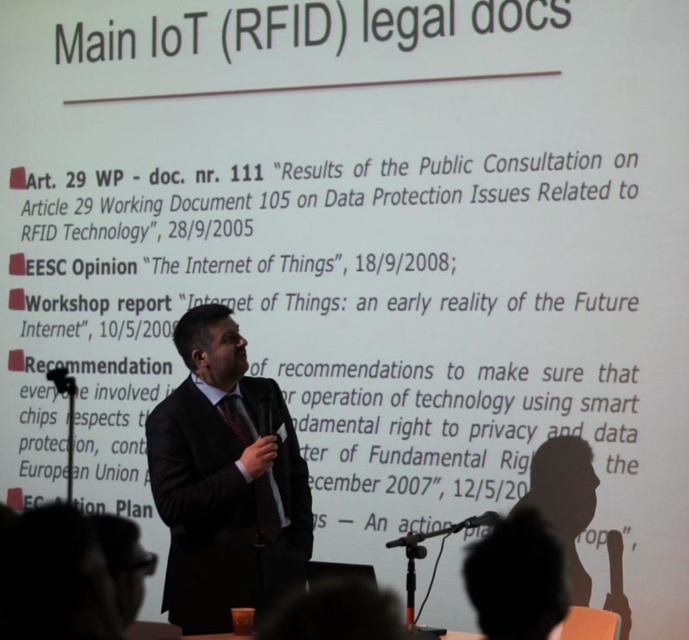
You are an event organizer and need to place a podium for the speaker wearing the black suit at center. According to the 2D coordinates provided, what are the exact coordinates where the podium should be placed to ensure it is directly behind the speaker?

The podium should be placed at the same coordinates as the black suit at center, which is point [225,481], to ensure it is directly behind the speaker.

You are a photographer standing at the camera position. You need to capture a clear photo of the black suit at center. The minimum focusing distance of your camera is 4 meters. Can you take the photo without moving closer?

The distance between the black suit at center and the camera is 4.21 meters, which is slightly beyond the camera minimum focusing distance of 4 meters. Therefore, you can take the photo without moving closer.

You are a stagehand preparing to adjust the microphone stand for the speaker in a presentation. The speaker is wearing a black suit at center and holding a black plastic microphone at lower center. The microphone is currently 3.35 feet away from the speaker. According to safety guidelines, the microphone should be positioned no more than 2 feet away from the speaker to ensure clear audio. Can the microphone stand be moved closer to the speaker to meet this requirement?

The black suit at center is currently 3.35 feet away from the black plastic microphone at lower center. Since the safety guideline requires the microphone to be no more than 2 feet away, the microphone stand needs to be moved closer to reduce the distance from 3.35 feet to within 2 feet. This adjustment will help meet the audio clarity requirements.